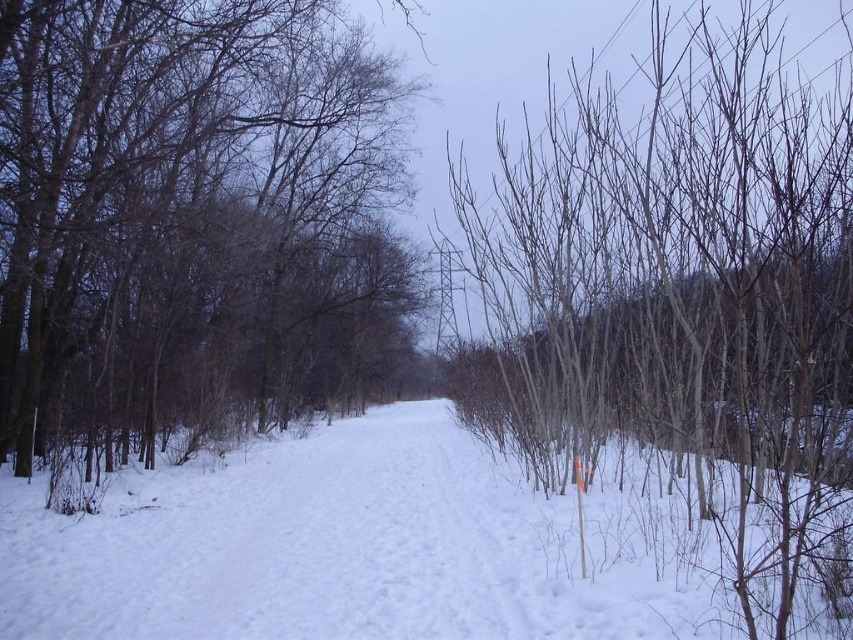
Question: Which is nearer to the smooth bark trees at right?

Choices:
 (A) white powdery snow at center
 (B) smooth bark tree at center

Answer: (A)

Question: Does smooth bark trees at right have a smaller size compared to white powdery snow at center?

Choices:
 (A) no
 (B) yes

Answer: (A)

Question: Is smooth bark tree at center thinner than smooth bark trees at right?

Choices:
 (A) yes
 (B) no

Answer: (A)

Question: In this image, where is smooth bark tree at center located relative to white powdery snow at center?

Choices:
 (A) right
 (B) left

Answer: (B)

Question: Among these points, which one is nearest to the camera?

Choices:
 (A) (437, 525)
 (B) (262, 1)
 (C) (692, 396)

Answer: (C)

Question: Which point appears farthest from the camera in this image?

Choices:
 (A) (24, 230)
 (B) (502, 360)

Answer: (B)